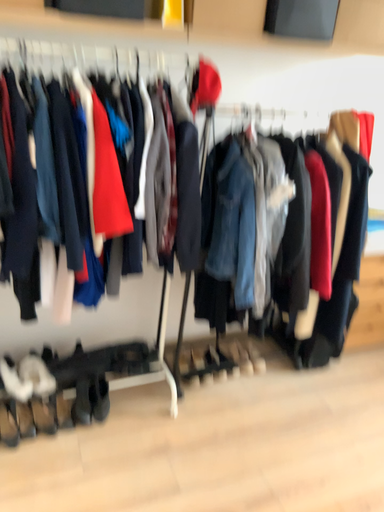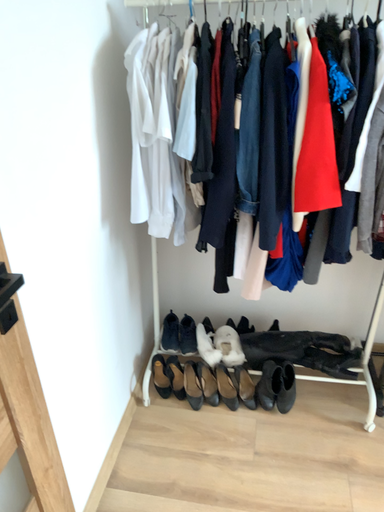
Question: Which way did the camera rotate in the video?

Choices:
 (A) rotated right
 (B) rotated left

Answer: (B)